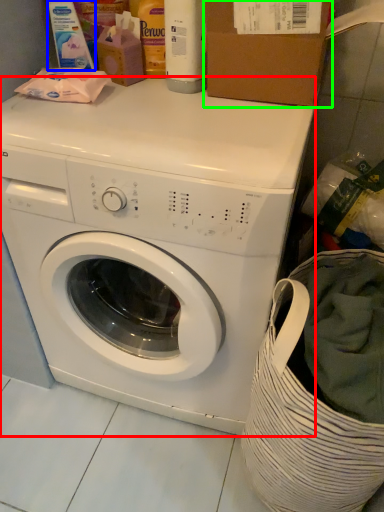
Question: Which object is positioned farthest from washing machine (highlighted by a red box)? Select from cleaning product (highlighted by a blue box) and cardboard box (highlighted by a green box).

Choices:
 (A) cleaning product
 (B) cardboard box

Answer: (A)